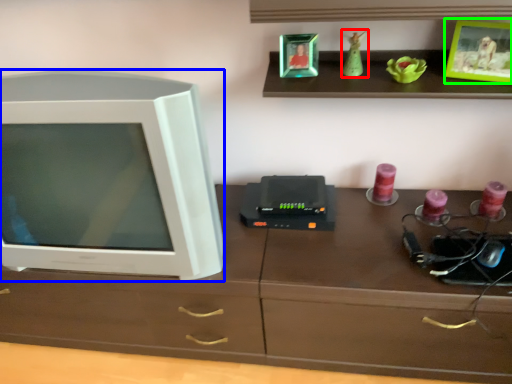
Question: Which is farther away from toy (highlighted by a red box)? television (highlighted by a blue box) or picture frame (highlighted by a green box)?

Choices:
 (A) television
 (B) picture frame

Answer: (A)